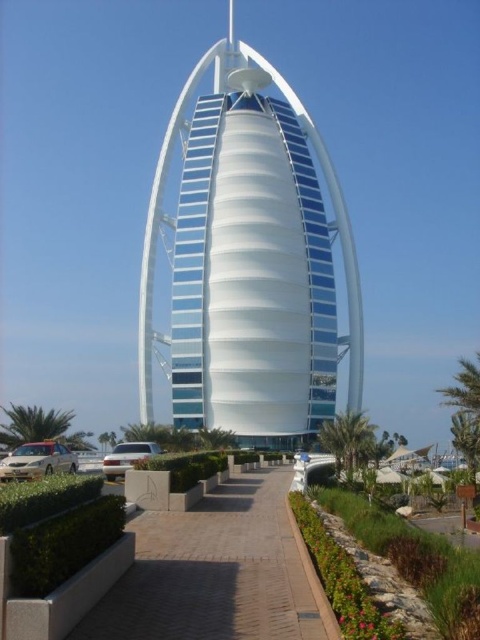
Question: Which of the following is the farthest from the observer?

Choices:
 (A) (289, 566)
 (B) (257, 138)

Answer: (B)

Question: Does white glass tower at center have a larger size compared to brick paved walkway at center?

Choices:
 (A) yes
 (B) no

Answer: (A)

Question: Is white glass tower at center wider than brick paved walkway at center?

Choices:
 (A) no
 (B) yes

Answer: (B)

Question: Can you confirm if white glass tower at center is thinner than brick paved walkway at center?

Choices:
 (A) yes
 (B) no

Answer: (B)